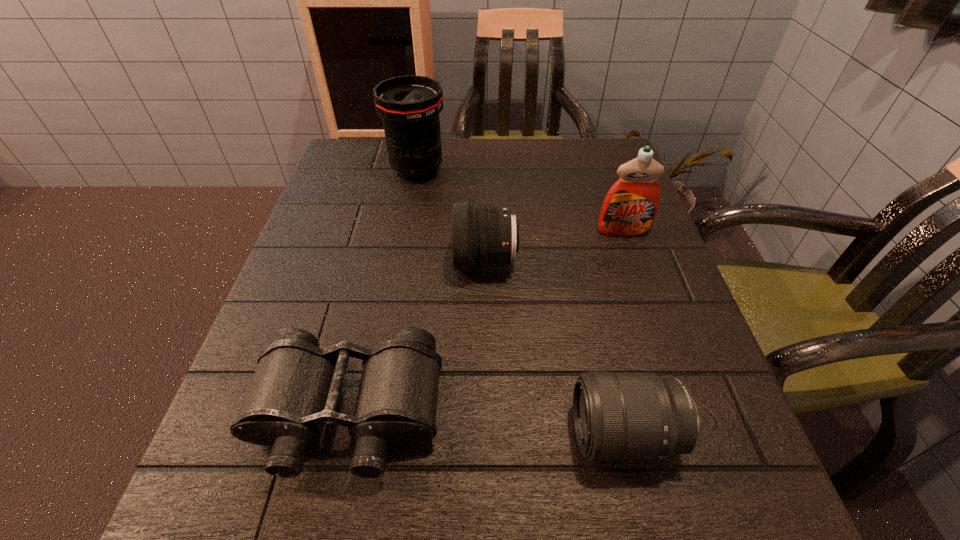
This screenshot has width=960, height=540. Identify the location of free area in between the nearest telephoto lens and the third nearest object. (555, 348).

Identify the location of blank region between the nearest telephoto lens and the binoculars. (486, 424).

Where is `vacant space that is in between the detergent and the farthest telephoto lens`? The image size is (960, 540). vacant space that is in between the detergent and the farthest telephoto lens is located at coordinates (520, 200).

The height and width of the screenshot is (540, 960). What are the coordinates of `free space between the detergent and the rightmost telephoto lens` in the screenshot? It's located at (623, 333).

In order to click on free space that is in between the nearest telephoto lens and the third farthest object in this screenshot , I will do `click(555, 348)`.

Where is `free spot between the nearest telephoto lens and the shortest object`? Image resolution: width=960 pixels, height=540 pixels. free spot between the nearest telephoto lens and the shortest object is located at coordinates (486, 424).

I want to click on unoccupied area between the shortest object and the rightmost telephoto lens, so click(x=486, y=424).

Find the location of a particular element. Image resolution: width=960 pixels, height=540 pixels. free area in between the detergent and the second nearest telephoto lens is located at coordinates (554, 246).

Identify which object is the third closest to the detergent. Please provide its 2D coordinates. Your answer should be formatted as a tuple, i.e. [(x, y)], where the tuple contains the x and y coordinates of a point satisfying the conditions above.

[(618, 416)]

Identify the location of object that is the closest to the shortest object. The width and height of the screenshot is (960, 540). (483, 236).